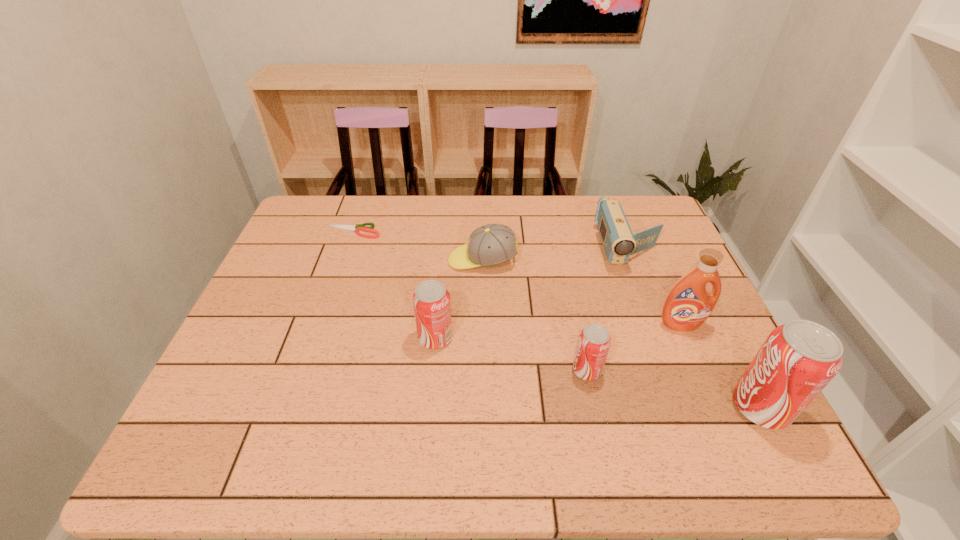
Locate an element on the screen. This screenshot has height=540, width=960. the fifth shortest object is located at coordinates (431, 300).

This screenshot has width=960, height=540. Identify the location of the farthest soda can. coord(431,300).

You are a GUI agent. You are given a task and a screenshot of the screen. Output one action in this format:
    pyautogui.click(x=<x>, y=<y>)
    Task: Click on the sixth farthest object
    
    Given the screenshot: What is the action you would take?
    pyautogui.click(x=594, y=341)

Find the location of a particular element. The image size is (960, 540). the fourth object from left to right is located at coordinates (594, 341).

What are the coordinates of `the tallest soda can` in the screenshot? It's located at (798, 359).

Locate an element on the screen. the nearest soda can is located at coordinates (798, 359).

The image size is (960, 540). Identify the location of camcorder. (619, 243).

Image resolution: width=960 pixels, height=540 pixels. I want to click on baseball cap, so click(x=491, y=244).

Image resolution: width=960 pixels, height=540 pixels. I want to click on the leftmost object, so click(x=359, y=227).

This screenshot has width=960, height=540. I want to click on scissors, so click(x=359, y=227).